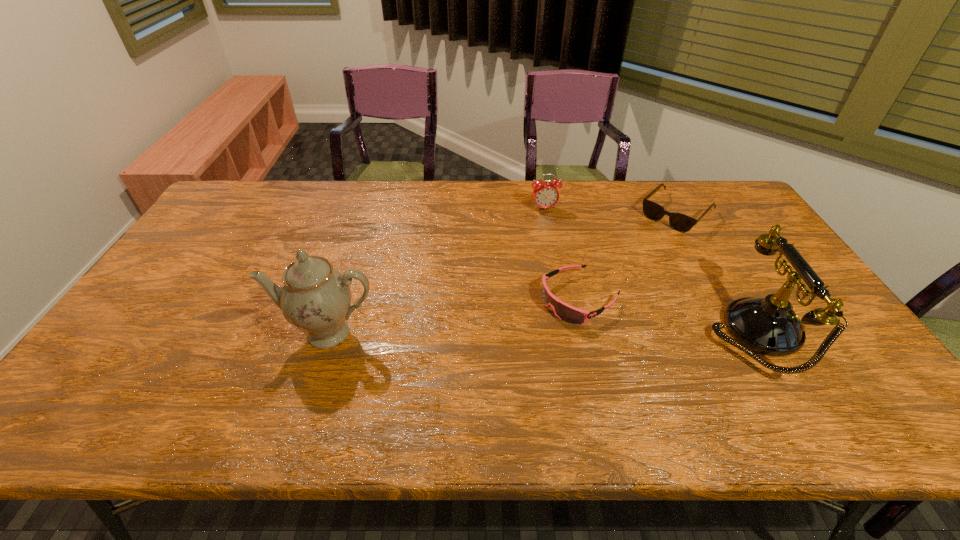
The height and width of the screenshot is (540, 960). I want to click on free point between the sunglasses and the goggles, so click(x=628, y=255).

The width and height of the screenshot is (960, 540). What are the coordinates of `vacant area that lies between the goggles and the second tallest object` in the screenshot? It's located at (666, 315).

Locate an element on the screen. The height and width of the screenshot is (540, 960). empty space that is in between the sunglasses and the fourth shortest object is located at coordinates (715, 273).

You are a GUI agent. You are given a task and a screenshot of the screen. Output one action in this format:
    pyautogui.click(x=<x>, y=<y>)
    Task: Click on the free area in between the alarm clock and the leftmost object
    This screenshot has height=540, width=960.
    Given the screenshot: What is the action you would take?
    pyautogui.click(x=436, y=271)

Identify the location of vacant point located between the second tallest object and the goggles. The height and width of the screenshot is (540, 960). (666, 315).

Where is `vacant area that lies between the alarm clock and the telephone`? This screenshot has height=540, width=960. vacant area that lies between the alarm clock and the telephone is located at coordinates (649, 271).

Where is `vacant space that's between the chinaware and the goggles`? The width and height of the screenshot is (960, 540). vacant space that's between the chinaware and the goggles is located at coordinates (454, 315).

This screenshot has height=540, width=960. In order to click on empty location between the goggles and the alarm clock in this screenshot , I will do `click(562, 254)`.

I want to click on vacant space in between the telephone and the leftmost object, so click(x=540, y=333).

This screenshot has width=960, height=540. I want to click on object that stands as the third closest to the sunglasses, so click(545, 194).